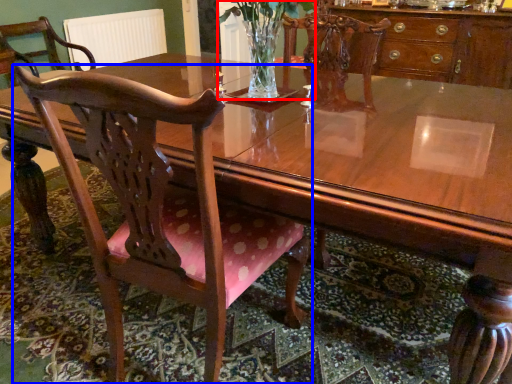
Question: Which object is closer to the camera taking this photo, floral arrangement (highlighted by a red box) or chair (highlighted by a blue box)?

Choices:
 (A) floral arrangement
 (B) chair

Answer: (B)